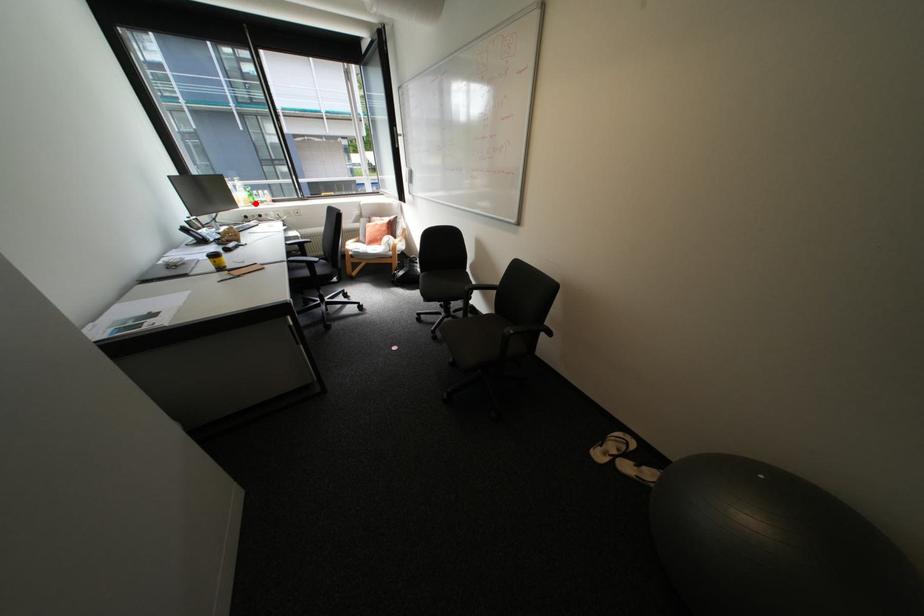
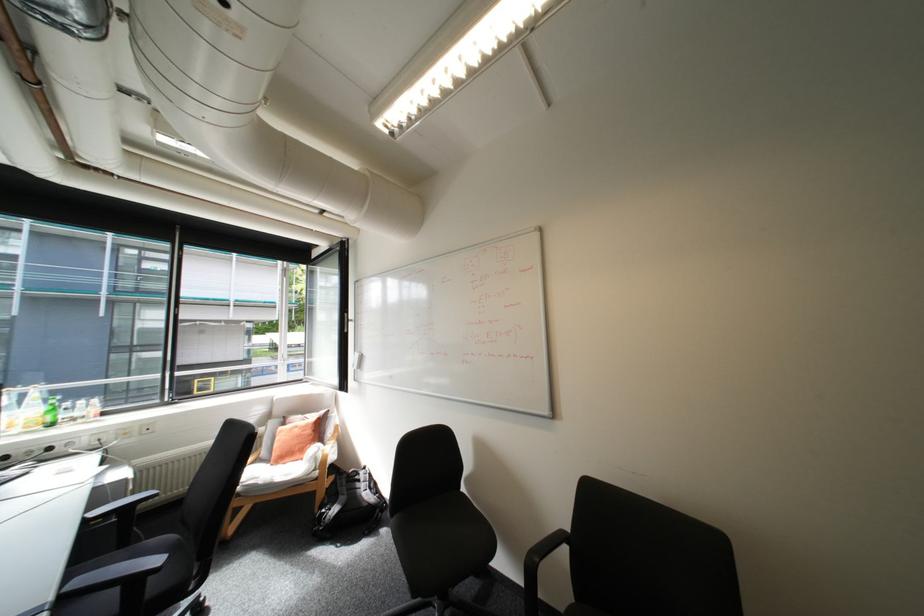
Question: I am providing you with two images of the same scene from different viewpoints. A red point is shown in image1. For the corresponding object point in image2, is it positioned nearer or farther from the camera?

Choices:
 (A) Nearer
 (B) Farther

Answer: (B)